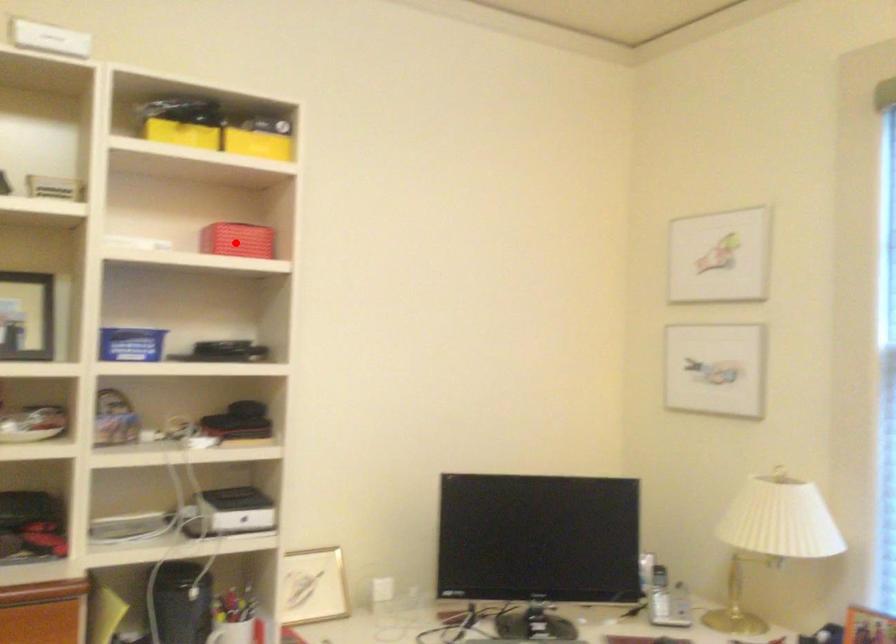
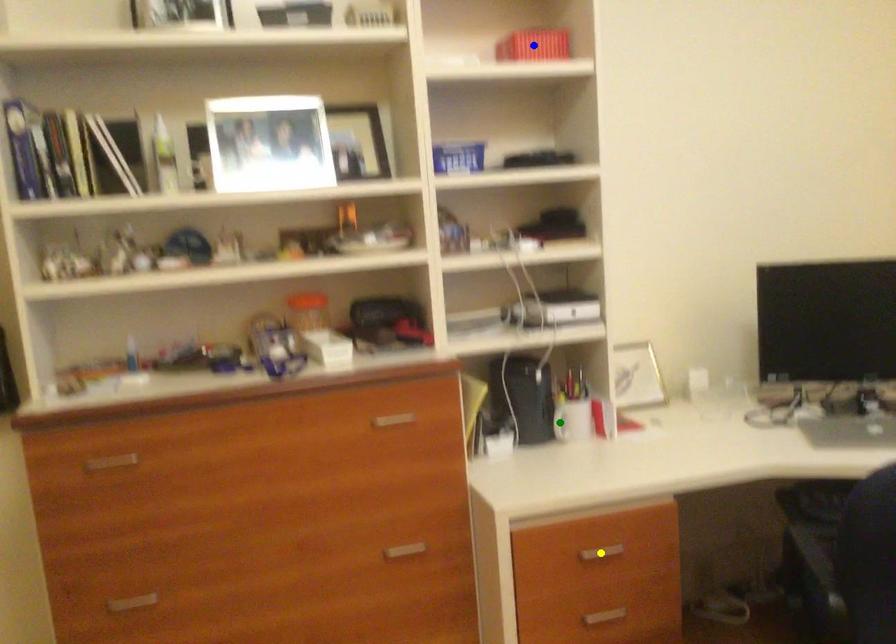
Question: I am providing you with two images of the same scene from different viewpoints. A red point is marked on the first image. You are given multiple points on the second image. Which point in image 2 represents the same 3d spot as the red point in image 1?

Choices:
 (A) blue point
 (B) green point
 (C) yellow point

Answer: (A)